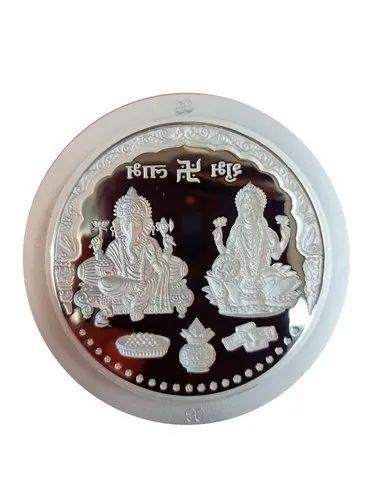
This screenshot has width=375, height=500. I want to click on ceramic, so click(151, 409).